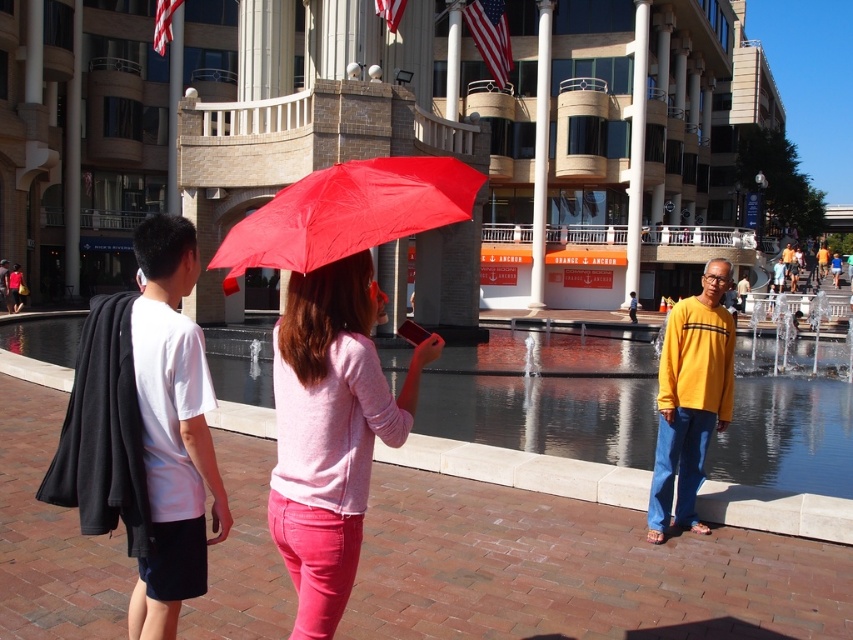
Does red matte umbrella at center come behind yellow long-sleeve shirt at center?

That is False.

Based on the photo, is red matte umbrella at center shorter than yellow long-sleeve shirt at center?

Yes.

This screenshot has width=853, height=640. I want to click on red matte umbrella at center, so click(347, 212).

Where is `matte pink sweater at center`? matte pink sweater at center is located at coordinates (831, 260).

Who is more distant from viewer, (827, 269) or (1, 300)?

Positioned behind is point (827, 269).

Does point (827, 262) lie in front of point (6, 292)?

No, it is not.

Locate an element on the screen. This screenshot has height=640, width=853. matte pink sweater at center is located at coordinates (x=831, y=260).

Between white matte t-shirt at center and matte black jacket at left, which one appears on the left side from the viewer's perspective?

From the viewer's perspective, matte black jacket at left appears more on the left side.

Which is in front, point (84, 401) or point (3, 268)?

Point (84, 401)

Is point (181, 364) positioned behind point (3, 304)?

No, it is in front of (3, 304).

What are the coordinates of `white matte t-shirt at center` in the screenshot? It's located at (144, 429).